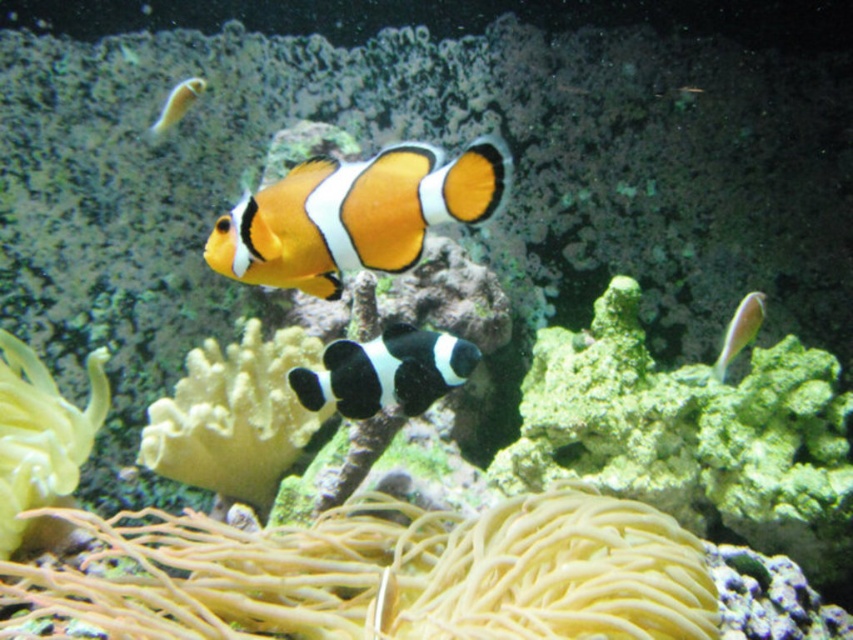
You are an underwater photographer aiming to capture a closeup of the clownfish. You notice two points in the scene marked as point (322, 173) and point (717, 376). Which point should you focus on to get a clearer image of the clownfish?

Point (322, 173) is closer to the camera than point (717, 376), so focusing on point (322, 173) would provide a clearer image of the clownfish.

You are a marine biologist observing an underwater scene. You notice a point at coordinates (234, 417). What object is located at this point?

The yellow soft coral at center is represented by point (234, 417).